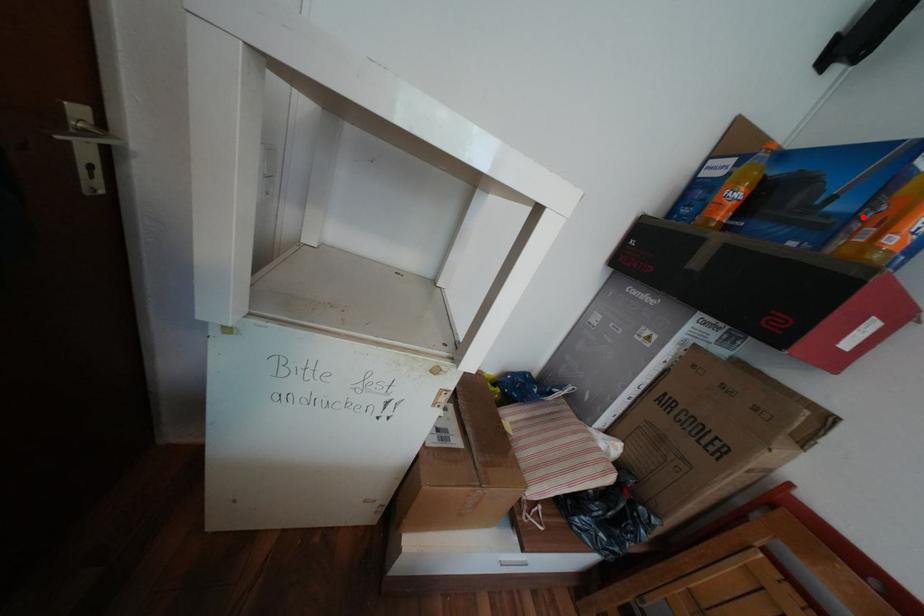
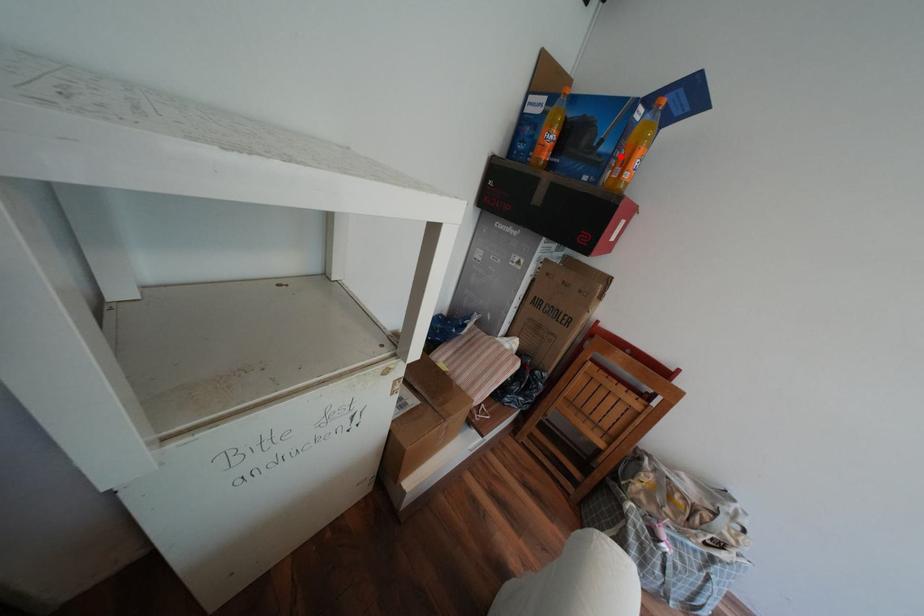
In the scene shown: I am providing you with two images of the same scene from different viewpoints. A red point is marked on the first image and another point is marked on the second image. Are the points marked in image1 and image2 representing the same 3D position?

Yes